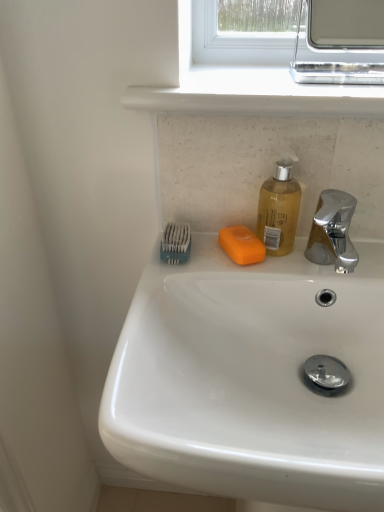
Where is `free region on the left part of translucent yellow liquid at upper center`? The height and width of the screenshot is (512, 384). free region on the left part of translucent yellow liquid at upper center is located at coordinates (195, 269).